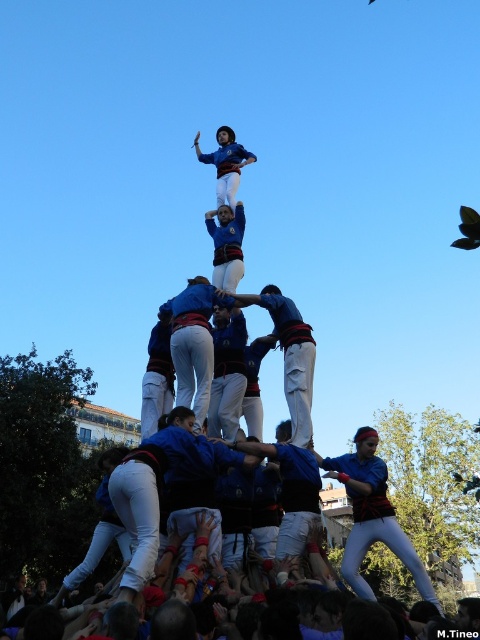
In the scene shown: Can you confirm if blue fabric at center is positioned above blue fabric person at upper center?

No.

Does point (220, 228) come farther from viewer compared to point (232, 168)?

No, it is in front of (232, 168).

Does point (229, 225) come behind point (218, 136)?

No, (229, 225) is in front of (218, 136).

The image size is (480, 640). I want to click on blue fabric at center, so click(227, 244).

Does blue fabric shirt at center have a greater height compared to blue fabric at center?

Indeed, blue fabric shirt at center has a greater height compared to blue fabric at center.

Between point (376, 442) and point (227, 280), which one is positioned in front?

Point (376, 442) is in front.

Where is `blue fabric shirt at center`? The height and width of the screenshot is (640, 480). blue fabric shirt at center is located at coordinates (372, 515).

You are a GUI agent. You are given a task and a screenshot of the screen. Output one action in this format:
    pyautogui.click(x=<x>, y=<y>)
    Task: Click on the blue fabric shirt at center
    
    Given the screenshot: What is the action you would take?
    pyautogui.click(x=372, y=515)

Which is behind, point (376, 493) or point (292, 310)?

Point (292, 310)

Is point (342, 470) more distant than point (285, 372)?

That is True.

The image size is (480, 640). Identify the location of blue fabric shirt at center. (372, 515).